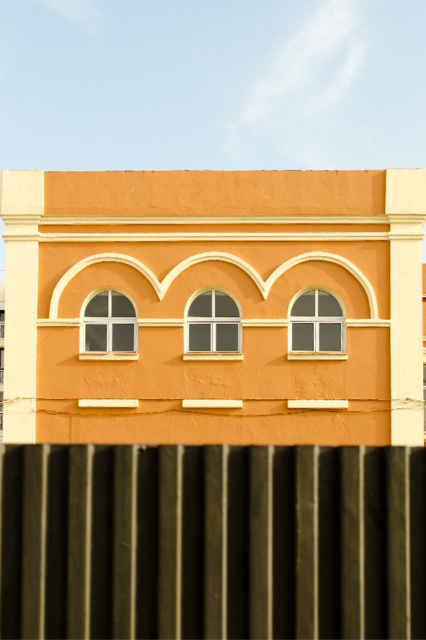
Looking at this image, you are an architect assessing the building facade. You need to determine which window has a wider opening between its frames. Which one is wider, the clear glass window at center or the white glass window at upper left?

The clear glass window at center has a wider opening between its frames compared to the white glass window at upper left, as its width is larger according to the description.

You are standing in front of the building and see two points on its facade. The first point is at coordinates point (233, 324) and the second is at point (333, 308). Which point is closer to you?

Point (233, 324) is closer to the camera than point (333, 308), so the first point is closer to you.

You are an architect reviewing a building design. You notice two windows at the center of the facade. The white glass window at center and the clear glass window at center. Which one is shorter?

The white glass window at center is not as tall as the clear glass window at center, so the white glass window at center is shorter.